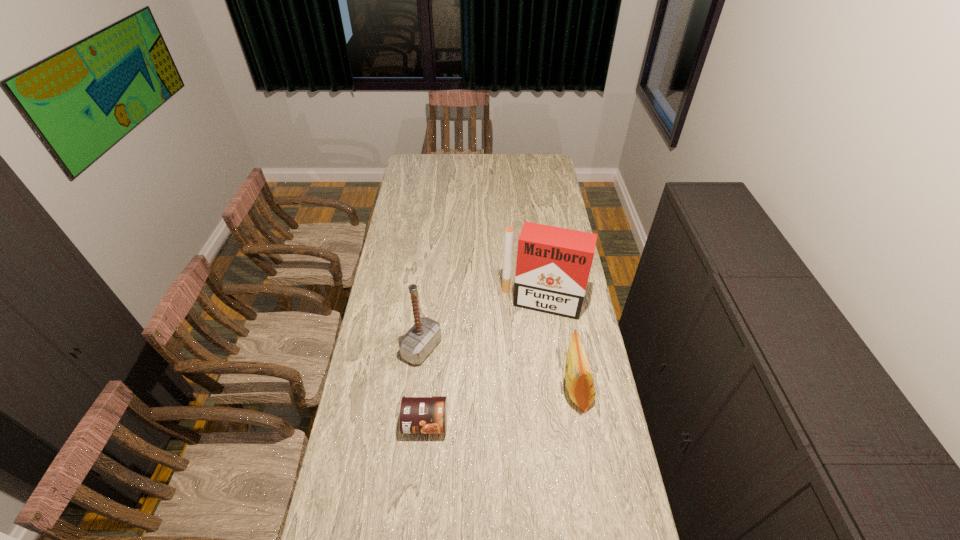
At what (x,y) coordinates should I click in order to perform the action: click on free area in between the second farthest object and the cigarette case. Please return your answer as a coordinate pair (x, y). The height and width of the screenshot is (540, 960). Looking at the image, I should click on (482, 326).

The image size is (960, 540). I want to click on vacant space that's between the cigarette case and the crisp (potato chip), so click(559, 347).

Identify the location of vacant area between the shortest object and the second farthest object. (x=423, y=386).

Locate an element on the screen. free area in between the hammer and the crisp (potato chip) is located at coordinates (499, 369).

I want to click on free space between the farthest object and the crisp (potato chip), so click(559, 347).

Image resolution: width=960 pixels, height=540 pixels. What are the coordinates of `empty space between the farthest object and the can` in the screenshot? It's located at (484, 363).

In order to click on blank region between the third nearest object and the shortest object in this screenshot , I will do 423,386.

Select which object is the second closest to the hammer. Please provide its 2D coordinates. Your answer should be formatted as a tuple, i.e. [(x, y)], where the tuple contains the x and y coordinates of a point satisfying the conditions above.

[(553, 265)]

Identify which object is the second nearest to the farthest object. Please provide its 2D coordinates. Your answer should be formatted as a tuple, i.e. [(x, y)], where the tuple contains the x and y coordinates of a point satisfying the conditions above.

[(425, 334)]

Image resolution: width=960 pixels, height=540 pixels. What are the coordinates of `vacant area that satisfies the following two spatial constraints: 1. on the front side of the crisp (potato chip); 2. on the front-facing side of the third nearest object` in the screenshot? It's located at (417, 390).